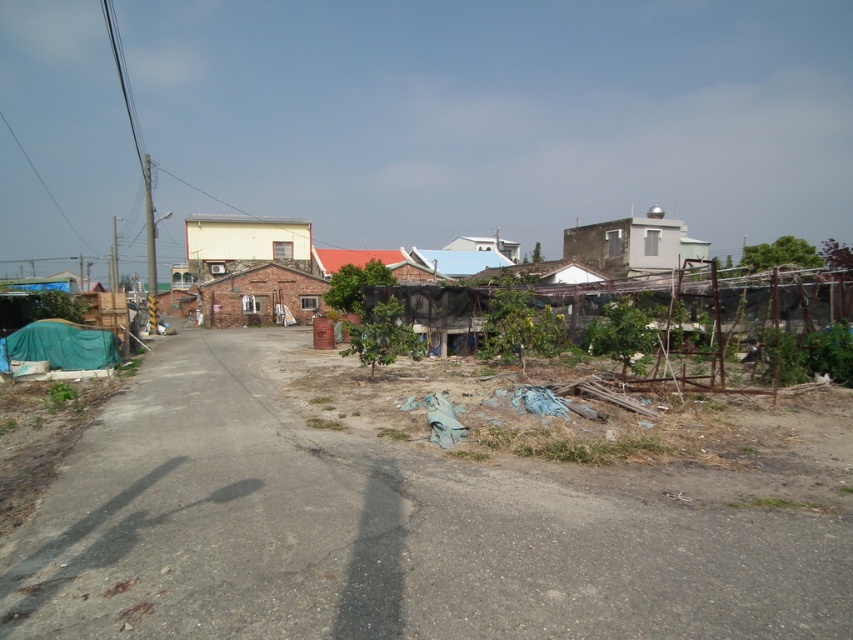
Looking at this image, can you confirm if brick house at center is thinner than white matte hut at center?

Yes, brick house at center is thinner than white matte hut at center.

Can you confirm if brick house at center is bigger than white matte hut at center?

Incorrect, brick house at center is not larger than white matte hut at center.

Between point (270, 280) and point (461, 240), which one is positioned in front?

Positioned in front is point (270, 280).

You are a GUI agent. You are given a task and a screenshot of the screen. Output one action in this format:
    pyautogui.click(x=<x>, y=<y>)
    Task: Click on the brick house at center
    The width and height of the screenshot is (853, 640).
    Given the screenshot: What is the action you would take?
    pyautogui.click(x=260, y=296)

Looking at this image, can you confirm if white matte building at center is shorter than white smooth building at upper right?

In fact, white matte building at center may be taller than white smooth building at upper right.

Between white matte building at center and white smooth building at upper right, which one has less height?

white smooth building at upper right is shorter.

Where is `white matte building at center`? This screenshot has height=640, width=853. white matte building at center is located at coordinates (244, 243).

Can you confirm if dirt road at center is thinner than white smooth building at upper right?

Indeed, dirt road at center has a lesser width compared to white smooth building at upper right.

Looking at this image, who is positioned more to the right, dirt road at center or white smooth building at upper right?

white smooth building at upper right is more to the right.

Does point (357, 512) come farther from viewer compared to point (651, 248)?

No, it is not.

Locate an element on the screen. dirt road at center is located at coordinates (376, 532).